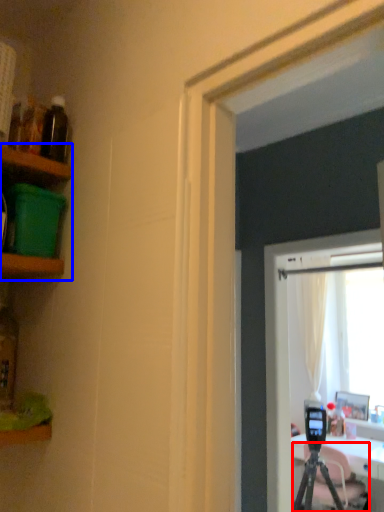
Question: Which object is further to the camera taking this photo, tripod (highlighted by a red box) or shelf (highlighted by a blue box)?

Choices:
 (A) tripod
 (B) shelf

Answer: (A)